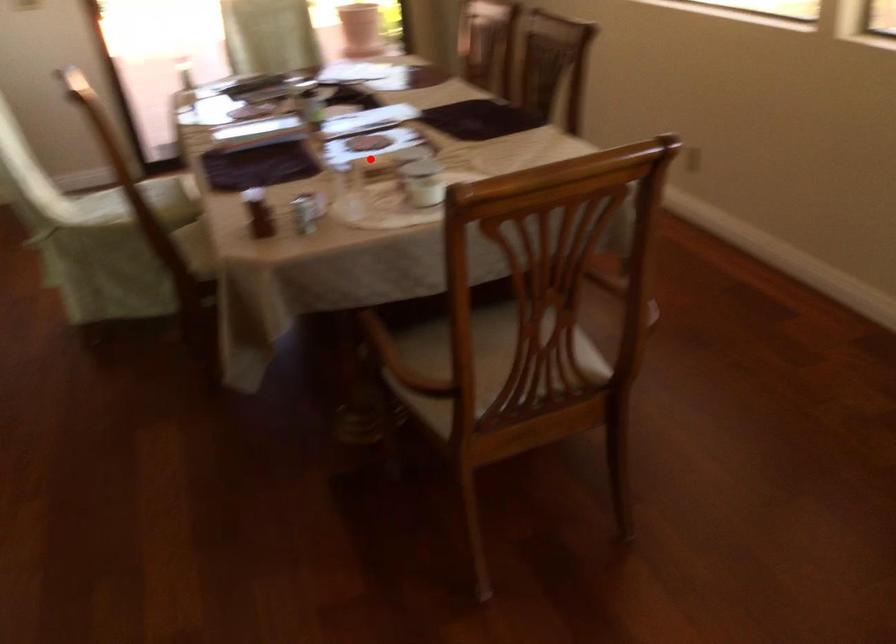
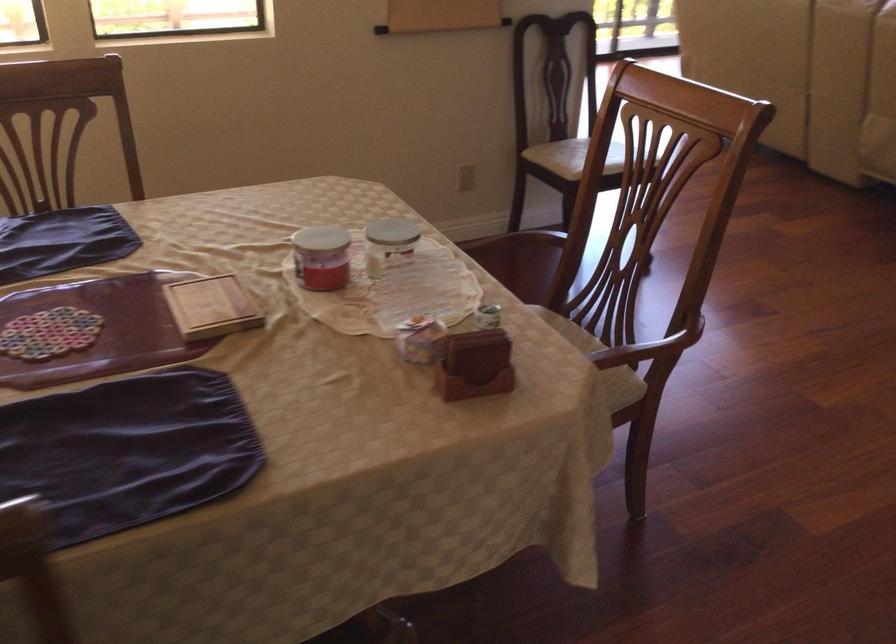
Question: A red point is marked in image1. In image2, is the corresponding 3D point closer to the camera or farther? Reply with the corresponding letter.

Choices:
 (A) The corresponding 3D point is closer.
 (B) The corresponding 3D point is farther.

Answer: (A)